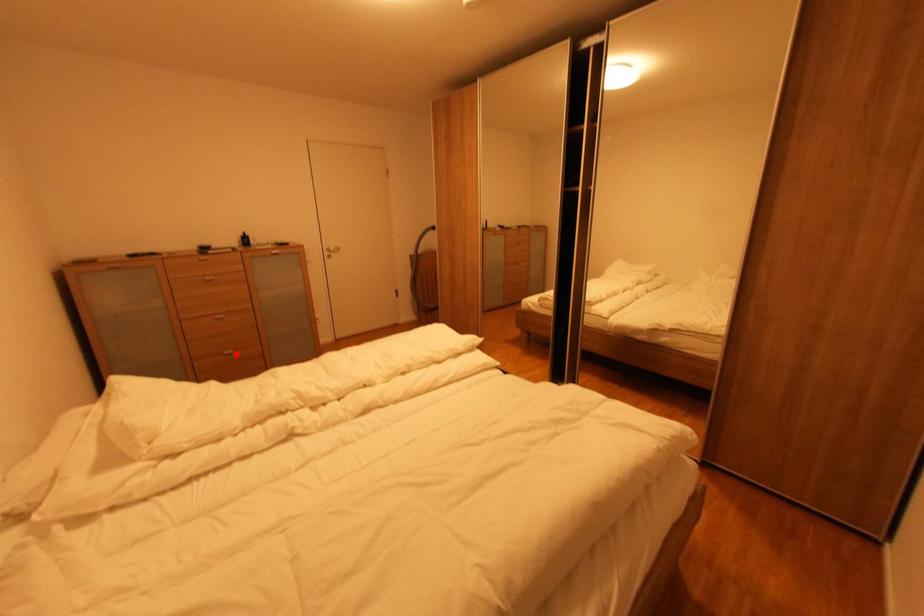
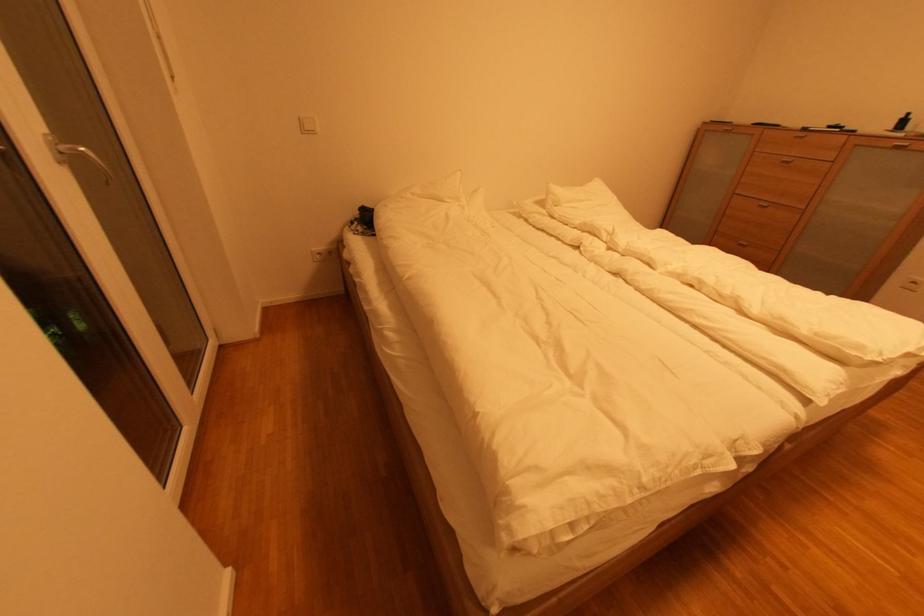
Question: I am providing you with two images of the same scene from different viewpoints. Given a red point in image1, look at the same physical point in image2. Is it:

Choices:
 (A) Closer to the viewpoint
 (B) Farther from the viewpoint

Answer: (A)